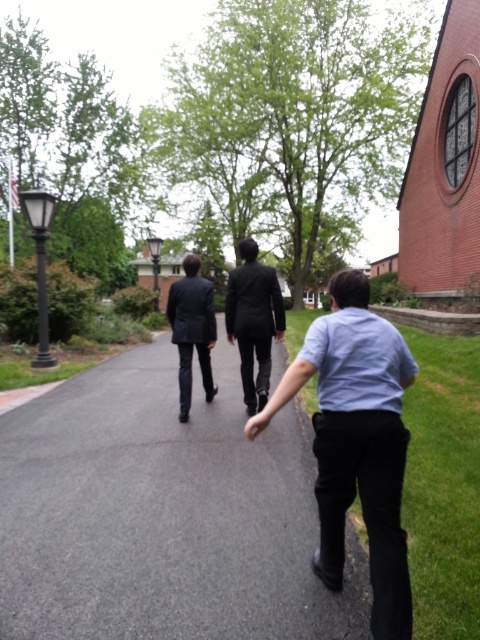
Question: Does gray asphalt pavement at center come behind dark suit at center?

Choices:
 (A) no
 (B) yes

Answer: (B)

Question: Is matte black suit at center thinner than dark suit at center?

Choices:
 (A) yes
 (B) no

Answer: (A)

Question: Does gray asphalt pavement at center have a larger size compared to dark suit at center?

Choices:
 (A) yes
 (B) no

Answer: (B)

Question: Among these objects, which one is farthest from the camera?

Choices:
 (A) light blue shirt at center
 (B) dark suit at center
 (C) matte black suit at center
 (D) gray asphalt pavement at center

Answer: (D)

Question: Which of the following is the closest to the observer?

Choices:
 (A) light blue shirt at center
 (B) matte black suit at center
 (C) dark suit at center
 (D) gray asphalt pavement at center

Answer: (A)

Question: Among these points, which one is nearest to the camera?

Choices:
 (A) (70, 561)
 (B) (189, 310)
 (C) (257, 362)
 (D) (382, 358)

Answer: (D)